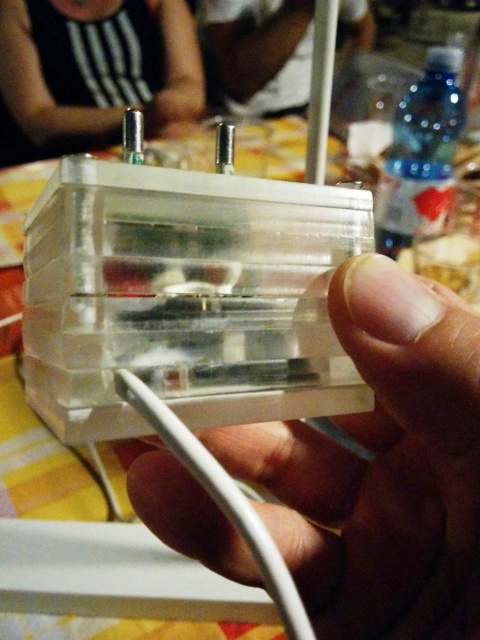
You are a delivery robot that needs to place an object on the table in the image. The table is at coordinates ranging from x 0.6 to 0.8 and y 0.7 to 0.9. Is the transparent plastic hand at center within this area?

The transparent plastic hand at center is located at point [382,467], which falls within the table area specified from x 0.6 to 0.8 and y 0.7 to 0.9. Therefore, the delivery robot can safely place the object there.

You are a fashion designer observing the image and need to decide which clothing item to recommend for a client who prefers wider sleeves. Based on the description, which item has a greater width between the black striped tank top at upper left and the white shirt at upper center?

The black striped tank top at upper left has a greater width than the white shirt at upper center, making it a better recommendation for wider sleeves.

You are a photographer standing 6 feet away from a table in a restaurant. You notice the black striped tank top at upper left in the background. Can you adjust your position to make the tank top appear closer in your photo without moving the tank top itself?

The black striped tank top at upper left is currently 5.35 feet away from the viewer. Since you are standing 6 feet away from the table, moving closer to the tank top by about 0.65 feet would reduce the distance, making it appear closer in the photo without moving the tank top itself.